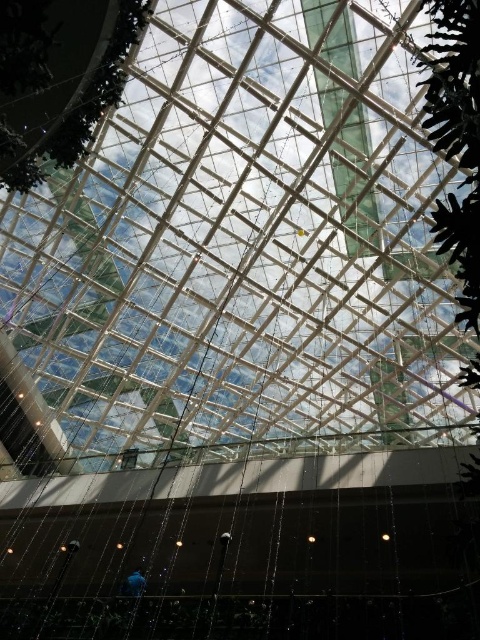
You are an architect designing a new building and want to ensure that the two green leafy trees in the ceiling design are spaced appropriately for structural support. Given that the recommended minimum distance between such trees for stability is 20 feet, does the current spacing between the green leafy tree at upper center and the green leafy tree at upper right meet this requirement?

The distance between the green leafy tree at upper center and the green leafy tree at upper right is 20.27 feet, which exceeds the recommended minimum of 20 feet for structural stability. Therefore, the current spacing meets the requirement.

You are an architect designing a new building and want to ensure that the green leafy tree at upper center is visible from the transparent glass roof at center. Based on the scene description, can the tree be seen through the roof?

The green leafy tree at upper center is behind the transparent glass roof at center, so yes, the tree can be seen through the roof.